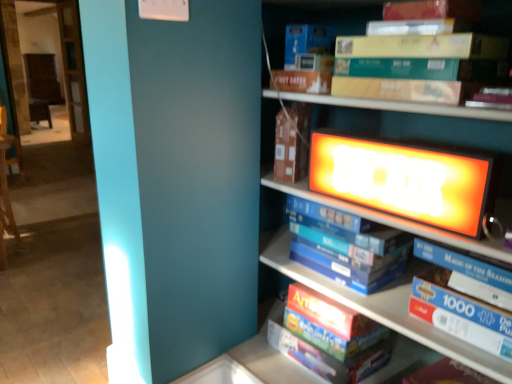
This screenshot has width=512, height=384. What do you see at coordinates (460, 313) in the screenshot?
I see `white glossy puzzle box at center, which is counted as the second book, starting from the bottom` at bounding box center [460, 313].

Where is `white glossy puzzle box at center, which is counted as the second book, starting from the bottom`? This screenshot has width=512, height=384. white glossy puzzle box at center, which is counted as the second book, starting from the bottom is located at coordinates (460, 313).

Based on the photo, what is the approximate height of yellow cardboard book at upper right, which is counted as the 4th book, starting from the bottom?

It is 10.30 inches.

Where is `blue cardboard puzzle at center, the third book positioned from the bottom`? The height and width of the screenshot is (384, 512). blue cardboard puzzle at center, the third book positioned from the bottom is located at coordinates (346, 246).

From the picture: Is yellow cardboard book at upper right, which is counted as the 4th book, starting from the bottom, to the right of red matte puzzle box at lower center, arranged as the 1th book when ordered from the bottom, from the viewer's perspective?

Yes.

The image size is (512, 384). Find the location of `book that is the 3rd one when counting upward from the red matte puzzle box at lower center, arranged as the 1th book when ordered from the bottom (from the image's perspective)`. book that is the 3rd one when counting upward from the red matte puzzle box at lower center, arranged as the 1th book when ordered from the bottom (from the image's perspective) is located at coordinates (314, 18).

From the picture: Considering the relative sizes of yellow cardboard book at upper right, the 1th book in the top-to-bottom sequence, and red matte puzzle box at lower center, which is counted as the fourth book, starting from the top, in the image provided, is yellow cardboard book at upper right, the 1th book in the top-to-bottom sequence, wider than red matte puzzle box at lower center, which is counted as the fourth book, starting from the top,?

Incorrect, the width of yellow cardboard book at upper right, the 1th book in the top-to-bottom sequence, does not surpass that of red matte puzzle box at lower center, which is counted as the fourth book, starting from the top.

From a real-world perspective, is yellow cardboard book at upper right, the 1th book in the top-to-bottom sequence, physically located above or below red matte puzzle box at lower center, arranged as the 1th book when ordered from the bottom?

yellow cardboard book at upper right, the 1th book in the top-to-bottom sequence, is situated higher than red matte puzzle box at lower center, arranged as the 1th book when ordered from the bottom, in the real world.

Could you tell me if matte wooden bookcase at upper right is turned towards brown cardboard book at center?

No.

Is matte wooden bookcase at upper right positioned far away from brown cardboard book at center?

No, there isn't a large distance between matte wooden bookcase at upper right and brown cardboard book at center.

From the image's perspective, which one is positioned lower, matte wooden bookcase at upper right or brown cardboard book at center?

matte wooden bookcase at upper right.

How many degrees apart are the facing directions of matte wooden bookcase at upper right and brown cardboard book at center?

There is a 3.81-degree angle between the facing directions of matte wooden bookcase at upper right and brown cardboard book at center.

From the picture: Is yellow cardboard book at upper right, the 1th book in the top-to-bottom sequence, further to camera compared to matte wooden bookcase at upper right?

Yes.

Is yellow cardboard book at upper right, which is counted as the 4th book, starting from the bottom, directly adjacent to matte wooden bookcase at upper right?

yellow cardboard book at upper right, which is counted as the 4th book, starting from the bottom, is not next to matte wooden bookcase at upper right, and they're not touching.

Between yellow cardboard book at upper right, the 1th book in the top-to-bottom sequence, and matte wooden bookcase at upper right, which one appears on the right side from the viewer's perspective?

From the viewer's perspective, matte wooden bookcase at upper right appears more on the right side.

Considering the relative sizes of blue cardboard puzzle at center, placed as the 2th book when sorted from top to bottom, and red matte puzzle box at lower center, which is counted as the fourth book, starting from the top, in the image provided, is blue cardboard puzzle at center, placed as the 2th book when sorted from top to bottom, smaller than red matte puzzle box at lower center, which is counted as the fourth book, starting from the top,?

Yes.

Considering the sizes of blue cardboard puzzle at center, placed as the 2th book when sorted from top to bottom, and red matte puzzle box at lower center, which is counted as the fourth book, starting from the top, in the image, is blue cardboard puzzle at center, placed as the 2th book when sorted from top to bottom, taller or shorter than red matte puzzle box at lower center, which is counted as the fourth book, starting from the top,?

blue cardboard puzzle at center, placed as the 2th book when sorted from top to bottom, is taller than red matte puzzle box at lower center, which is counted as the fourth book, starting from the top.

Does blue cardboard puzzle at center, placed as the 2th book when sorted from top to bottom, appear on the right side of red matte puzzle box at lower center, arranged as the 1th book when ordered from the bottom?

Incorrect, blue cardboard puzzle at center, placed as the 2th book when sorted from top to bottom, is not on the right side of red matte puzzle box at lower center, arranged as the 1th book when ordered from the bottom.

Can you confirm if blue cardboard puzzle at center, placed as the 2th book when sorted from top to bottom, is thinner than red matte puzzle box at lower center, arranged as the 1th book when ordered from the bottom?

Yes, blue cardboard puzzle at center, placed as the 2th book when sorted from top to bottom, is thinner than red matte puzzle box at lower center, arranged as the 1th book when ordered from the bottom.

Does point (375, 9) lie in front of point (421, 300)?

No, (375, 9) is behind (421, 300).

Where is `book that is on the right side of yellow cardboard book at upper right, the 1th book in the top-to-bottom sequence`? book that is on the right side of yellow cardboard book at upper right, the 1th book in the top-to-bottom sequence is located at coordinates (460, 313).

Considering the sizes of objects yellow cardboard book at upper right, which is counted as the 4th book, starting from the bottom, and white glossy puzzle box at center, which is counted as the second book, starting from the bottom, in the image provided, who is bigger, yellow cardboard book at upper right, which is counted as the 4th book, starting from the bottom, or white glossy puzzle box at center, which is counted as the second book, starting from the bottom,?

white glossy puzzle box at center, which is counted as the second book, starting from the bottom.

Is yellow cardboard book at upper right, the 1th book in the top-to-bottom sequence, positioned far away from white glossy puzzle box at center, which is counted as the second book, starting from the bottom?

yellow cardboard book at upper right, the 1th book in the top-to-bottom sequence, is near white glossy puzzle box at center, which is counted as the second book, starting from the bottom, not far away.

Considering the sizes of objects white glossy puzzle box at center, the third book positioned from the top, and blue cardboard puzzle at center, the third book positioned from the bottom, in the image provided, who is shorter, white glossy puzzle box at center, the third book positioned from the top, or blue cardboard puzzle at center, the third book positioned from the bottom,?

white glossy puzzle box at center, the third book positioned from the top.

How distant is white glossy puzzle box at center, the third book positioned from the top, from blue cardboard puzzle at center, placed as the 2th book when sorted from top to bottom?

white glossy puzzle box at center, the third book positioned from the top, and blue cardboard puzzle at center, placed as the 2th book when sorted from top to bottom, are 24.92 centimeters apart.

From the image's perspective, is white glossy puzzle box at center, which is counted as the second book, starting from the bottom, below blue cardboard puzzle at center, placed as the 2th book when sorted from top to bottom?

Yes, from the image's perspective, white glossy puzzle box at center, which is counted as the second book, starting from the bottom, is beneath blue cardboard puzzle at center, placed as the 2th book when sorted from top to bottom.

Is white glossy puzzle box at center, the third book positioned from the top, to the left or to the right of blue cardboard puzzle at center, placed as the 2th book when sorted from top to bottom, in the image?

Based on their positions, white glossy puzzle box at center, the third book positioned from the top, is located to the right of blue cardboard puzzle at center, placed as the 2th book when sorted from top to bottom.

Is blue cardboard puzzle at center, placed as the 2th book when sorted from top to bottom, oriented away from white glossy puzzle box at center, the third book positioned from the top?

No, blue cardboard puzzle at center, placed as the 2th book when sorted from top to bottom,'s orientation is not away from white glossy puzzle box at center, the third book positioned from the top.

From a real-world perspective, is blue cardboard puzzle at center, the third book positioned from the bottom, under white glossy puzzle box at center, which is counted as the second book, starting from the bottom?

No, from a real-world perspective, blue cardboard puzzle at center, the third book positioned from the bottom, is not under white glossy puzzle box at center, which is counted as the second book, starting from the bottom.

The image size is (512, 384). I want to click on book that is the 1st one below the blue cardboard puzzle at center, the third book positioned from the bottom (from a real-world perspective), so click(460, 313).

From the image's perspective, starting from the red matte puzzle box at lower center, arranged as the 1th book when ordered from the bottom, which book is the 3rd one above? Please provide its 2D coordinates.

[(314, 18)]

Where is `paperback book located behind the matte wooden bookcase at upper right`? This screenshot has width=512, height=384. paperback book located behind the matte wooden bookcase at upper right is located at coordinates (292, 143).

Considering their positions, is brown cardboard book at center positioned closer to yellow cardboard book at upper right, the 1th book in the top-to-bottom sequence, than white glossy puzzle box at center, which is counted as the second book, starting from the bottom?

The object closer to yellow cardboard book at upper right, the 1th book in the top-to-bottom sequence, is brown cardboard book at center.

Looking at the image, which one is located closer to white glossy puzzle box at center, which is counted as the second book, starting from the bottom, blue cardboard puzzle at center, placed as the 2th book when sorted from top to bottom, or red matte puzzle box at lower center, arranged as the 1th book when ordered from the bottom?

blue cardboard puzzle at center, placed as the 2th book when sorted from top to bottom.

Looking at the image, which one is located closer to brown cardboard book at center, matte wooden bookcase at upper right or red matte puzzle box at lower center, arranged as the 1th book when ordered from the bottom?

Based on the image, matte wooden bookcase at upper right appears to be nearer to brown cardboard book at center.

When comparing their distances from red matte puzzle box at lower center, which is counted as the fourth book, starting from the top, does yellow cardboard book at upper right, the 1th book in the top-to-bottom sequence, or white glossy puzzle box at center, the third book positioned from the top, seem closer?

white glossy puzzle box at center, the third book positioned from the top, is closer to red matte puzzle box at lower center, which is counted as the fourth book, starting from the top.

Estimate the real-world distances between objects in this image. Which object is further from white glossy puzzle box at center, which is counted as the second book, starting from the bottom, brown cardboard book at center or matte wooden bookcase at upper right?

matte wooden bookcase at upper right is positioned further to the anchor white glossy puzzle box at center, which is counted as the second book, starting from the bottom.

Considering their positions, is blue cardboard puzzle at center, placed as the 2th book when sorted from top to bottom, positioned further to brown cardboard book at center than yellow cardboard book at upper right, which is counted as the 4th book, starting from the bottom?

yellow cardboard book at upper right, which is counted as the 4th book, starting from the bottom, is further to brown cardboard book at center.

When comparing their distances from red matte puzzle box at lower center, arranged as the 1th book when ordered from the bottom, does blue cardboard puzzle at center, placed as the 2th book when sorted from top to bottom, or white glossy puzzle box at center, which is counted as the second book, starting from the bottom, seem further?

white glossy puzzle box at center, which is counted as the second book, starting from the bottom, is positioned further to the anchor red matte puzzle box at lower center, arranged as the 1th book when ordered from the bottom.

Based on their spatial positions, is blue cardboard puzzle at center, placed as the 2th book when sorted from top to bottom, or white glossy puzzle box at center, the third book positioned from the top, closer to yellow cardboard book at upper right, which is counted as the 4th book, starting from the bottom?

Based on the image, blue cardboard puzzle at center, placed as the 2th book when sorted from top to bottom, appears to be nearer to yellow cardboard book at upper right, which is counted as the 4th book, starting from the bottom.

Identify the location of bookcase between yellow cardboard book at upper right, the 1th book in the top-to-bottom sequence, and white glossy puzzle box at center, the third book positioned from the top, from top to bottom. The image size is (512, 384). click(x=432, y=137).

Locate an element on the screen. book that lies between yellow cardboard book at upper right, the 1th book in the top-to-bottom sequence, and white glossy puzzle box at center, which is counted as the second book, starting from the bottom, from top to bottom is located at coordinates (346, 246).

You are a GUI agent. You are given a task and a screenshot of the screen. Output one action in this format:
    pyautogui.click(x=<x>, y=<y>)
    Task: Click on the paperback book between yellow cardboard book at upper right, which is counted as the 4th book, starting from the bottom, and red matte puzzle box at lower center, arranged as the 1th book when ordered from the bottom, from top to bottom
    Image resolution: width=512 pixels, height=384 pixels.
    Given the screenshot: What is the action you would take?
    pyautogui.click(x=292, y=143)

You are a GUI agent. You are given a task and a screenshot of the screen. Output one action in this format:
    pyautogui.click(x=<x>, y=<y>)
    Task: Click on the paperback book between yellow cardboard book at upper right, the 1th book in the top-to-bottom sequence, and blue cardboard puzzle at center, the third book positioned from the bottom, vertically
    The height and width of the screenshot is (384, 512).
    Given the screenshot: What is the action you would take?
    pyautogui.click(x=292, y=143)